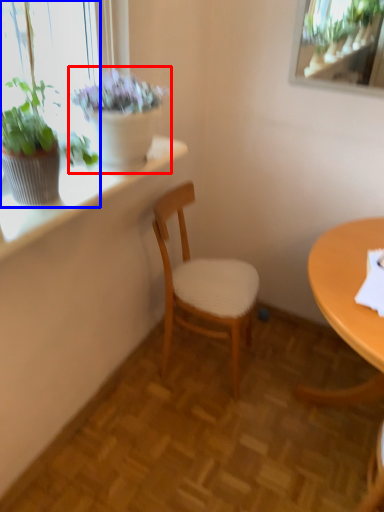
Question: Which object is further to the camera taking this photo, houseplant (highlighted by a red box) or houseplant (highlighted by a blue box)?

Choices:
 (A) houseplant
 (B) houseplant

Answer: (A)